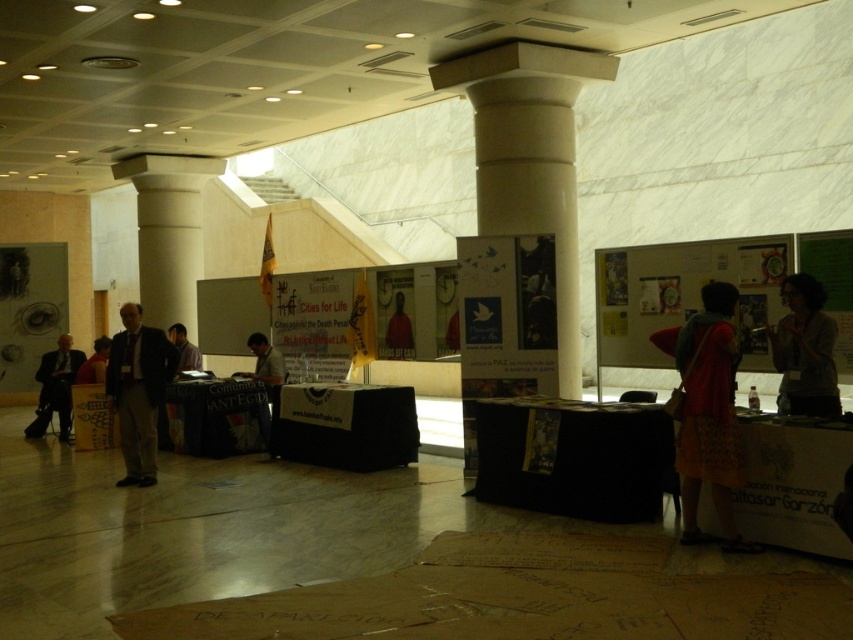
Does white marble pillar at upper center appear under matte brown shirt at center?

No.

Can you confirm if white marble pillar at upper center is taller than matte brown shirt at center?

Indeed, white marble pillar at upper center has a greater height compared to matte brown shirt at center.

Is point (189, 232) positioned before point (404, 305)?

No, (189, 232) is further to viewer.

Where is `white marble pillar at upper center`? The width and height of the screenshot is (853, 640). white marble pillar at upper center is located at coordinates (167, 230).

Is point (547, 392) farther from viewer compared to point (201, 365)?

That is False.

Is point (593, 77) positioned before point (175, 340)?

Yes, point (593, 77) is closer to viewer.

You are a GUI agent. You are given a task and a screenshot of the screen. Output one action in this format:
    pyautogui.click(x=<x>, y=<y>)
    Task: Click on the white marble pillar at center
    This screenshot has width=853, height=640.
    Given the screenshot: What is the action you would take?
    pyautogui.click(x=531, y=157)

Is white marble pillar at upper center wider than matte black suit at left?

Yes.

Does white marble pillar at upper center come in front of matte black suit at left?

No, white marble pillar at upper center is behind matte black suit at left.

Locate an element on the screen. This screenshot has height=640, width=853. white marble pillar at upper center is located at coordinates (167, 230).

The height and width of the screenshot is (640, 853). Find the location of `white marble pillar at upper center`. white marble pillar at upper center is located at coordinates (167, 230).